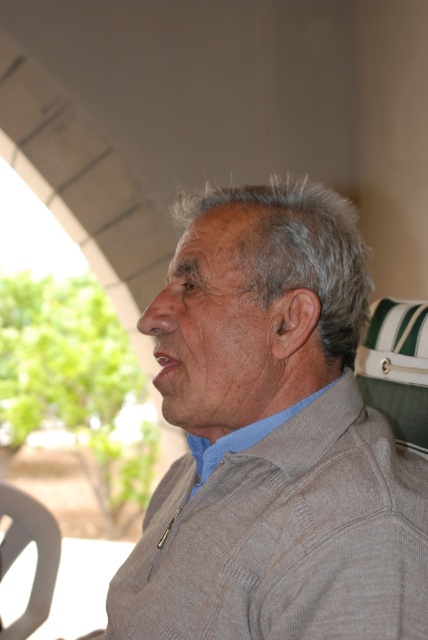
You are a tailor measuring fabrics for a customer. You have a gray knitted sweater at center and a light blue fabric at center in front of you. Which fabric has a greater width according to the image?

The gray knitted sweater at center might be wider than light blue fabric at center, so it is likely the gray knitted sweater at center has a greater width.

You are standing in a park and see an elderly man sitting at point (216, 209). If you want to approach him without getting too close, what is the minimum distance you should maintain?

The minimum distance you should maintain is 31.20 inches because that is the distance between you and the point where the elderly man is sitting.

You are an assistant helping someone choose an outfit. The person wants to know which item is on the left side of their outfit. They are wearing a gray knitted sweater at center and a light blue fabric at center. Can you tell them which one is positioned to the left?

The gray knitted sweater at center is to the left of the light blue fabric at center, so the gray knitted sweater at center is positioned to the left.